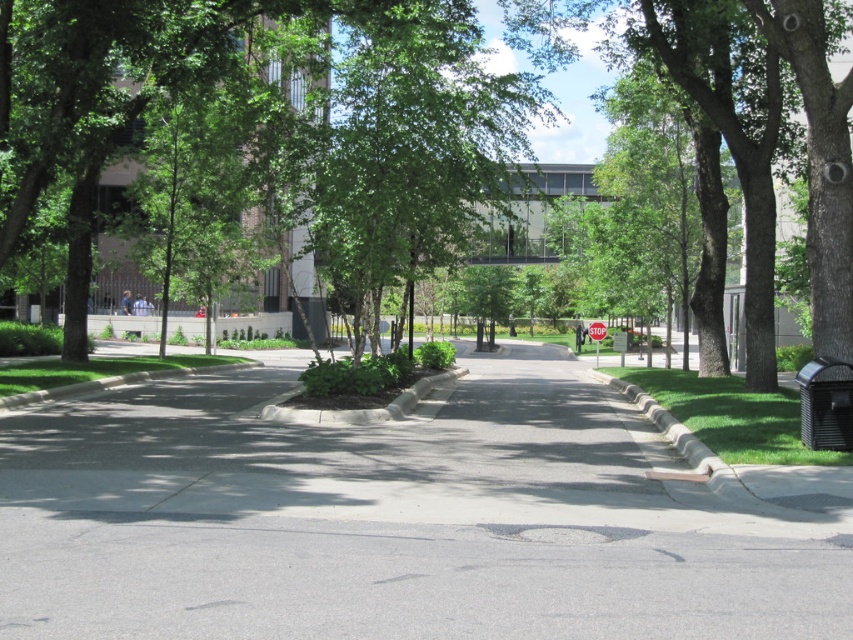
Question: Is gray asphalt pavement at center bigger than green leafy tree at center?

Choices:
 (A) no
 (B) yes

Answer: (A)

Question: Can you confirm if gray asphalt pavement at center is thinner than green leafy tree at center?

Choices:
 (A) no
 (B) yes

Answer: (B)

Question: Which point appears closest to the camera in this image?

Choices:
 (A) (668, 516)
 (B) (666, 51)

Answer: (A)

Question: Is gray asphalt pavement at center above green leafy tree at center?

Choices:
 (A) no
 (B) yes

Answer: (A)